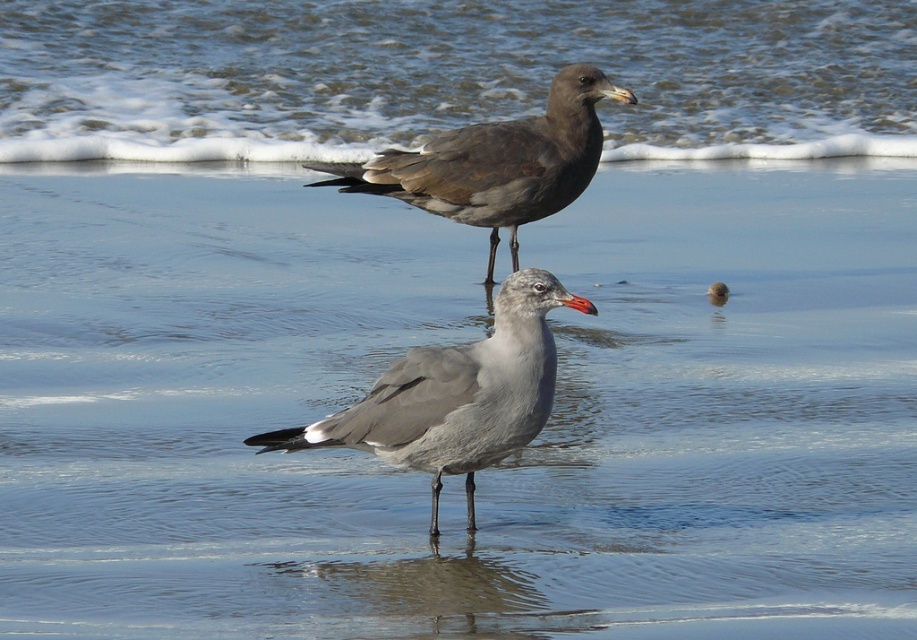
Question: Among these points, which one is farthest from the camera?

Choices:
 (A) (422, 150)
 (B) (470, 364)
 (C) (779, 76)

Answer: (C)

Question: Does clear water at upper center appear over gray matte seagull at center?

Choices:
 (A) yes
 (B) no

Answer: (A)

Question: Which point appears closest to the camera in this image?

Choices:
 (A) (724, 88)
 (B) (581, 144)

Answer: (B)

Question: Does clear water at upper center have a lesser width compared to gray matte seagull at center?

Choices:
 (A) no
 (B) yes

Answer: (A)

Question: Which object appears farthest from the camera in this image?

Choices:
 (A) dark brown feathers at upper center
 (B) gray matte seagull at center
 (C) clear water at upper center

Answer: (C)

Question: Can you confirm if gray matte seagull at center is positioned below dark brown feathers at upper center?

Choices:
 (A) yes
 (B) no

Answer: (A)